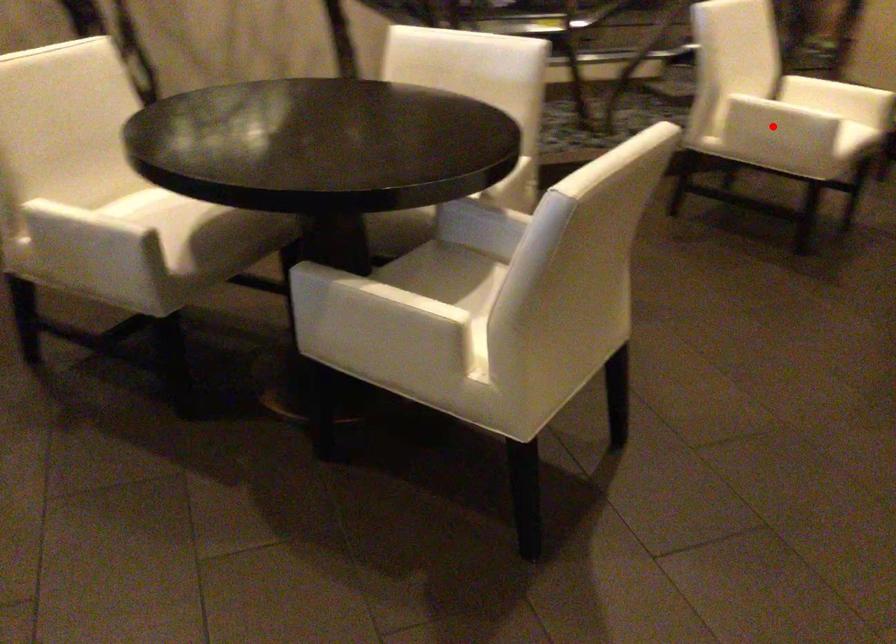
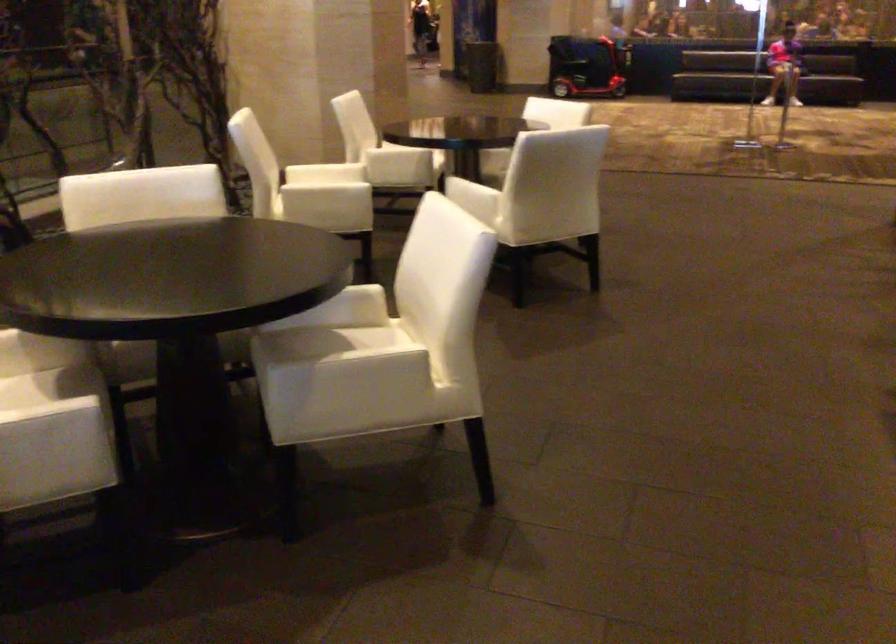
Question: I am providing you with two images of the same scene from different viewpoints. A red point is shown in image1. For the corresponding object point in image2, is it positioned nearer or farther from the camera?

Choices:
 (A) Nearer
 (B) Farther

Answer: (B)